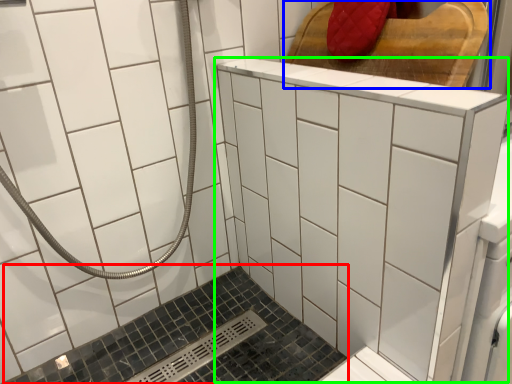
Question: Which is nearer to the bath (highlighted by a red box)? furniture (highlighted by a blue box) or ceramic tile (highlighted by a green box).

Choices:
 (A) furniture
 (B) ceramic tile

Answer: (B)